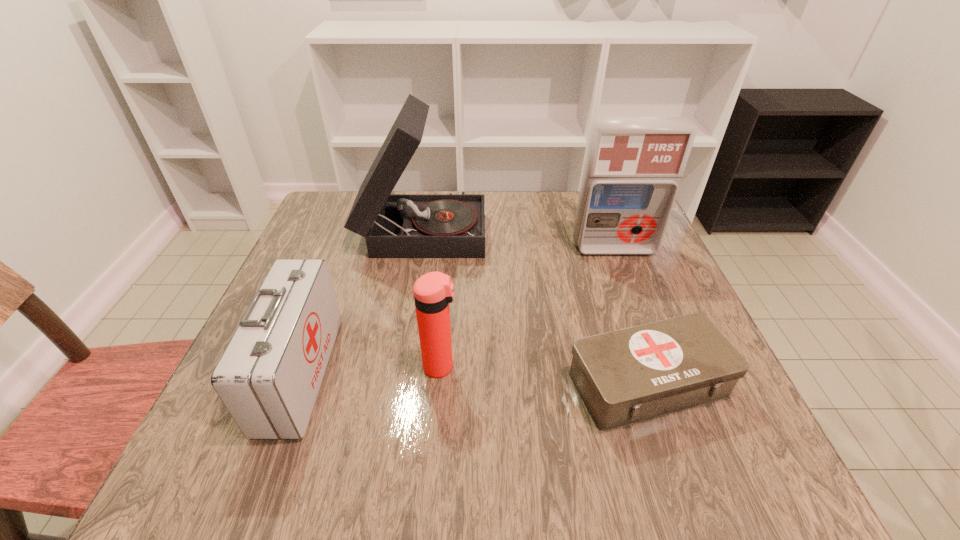
Identify the location of vacant region that satisfies the following two spatial constraints: 1. on the front side of the thermos bottle; 2. on the front-facing side of the leftmost first-aid kit. (440, 373).

Where is `free point that satisfies the following two spatial constraints: 1. on the front-facing side of the phonograph_record; 2. on the back side of the shortest object`? free point that satisfies the following two spatial constraints: 1. on the front-facing side of the phonograph_record; 2. on the back side of the shortest object is located at coordinates (397, 383).

In order to click on free location that satisfies the following two spatial constraints: 1. on the front-facing side of the shortest object; 2. on the right side of the second shortest first-aid kit in this screenshot , I will do `click(297, 383)`.

You are a GUI agent. You are given a task and a screenshot of the screen. Output one action in this format:
    pyautogui.click(x=<x>, y=<y>)
    Task: Click on the free space that satisfies the following two spatial constraints: 1. on the front-facing side of the second shortest object; 2. on the back side of the shortest first-aid kit
    The height and width of the screenshot is (540, 960).
    Given the screenshot: What is the action you would take?
    pyautogui.click(x=297, y=383)